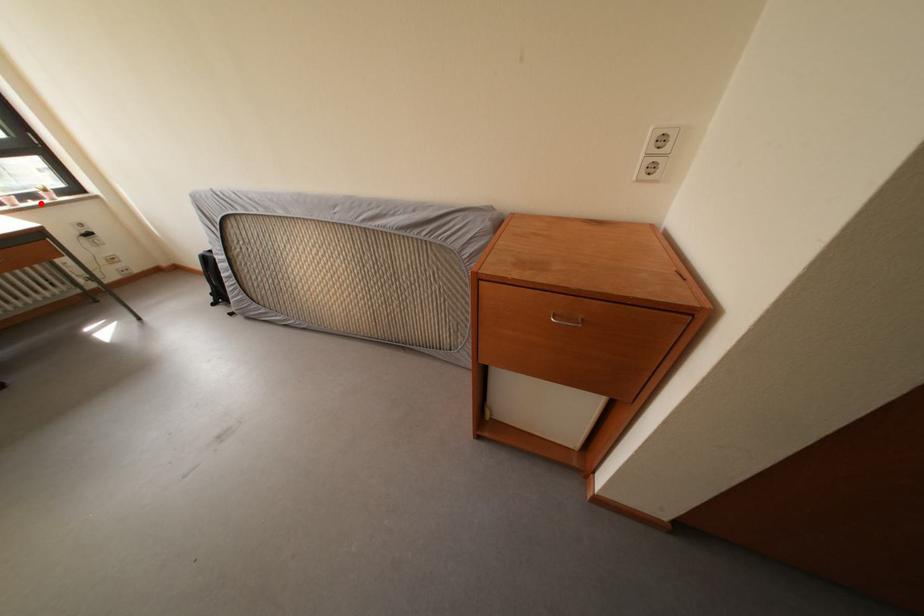
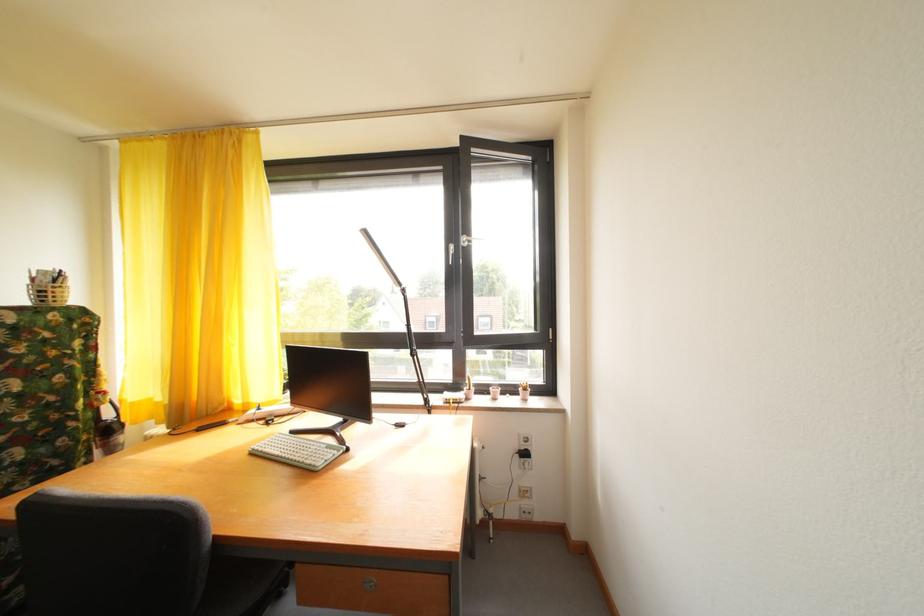
In the second image, find the point that corresponds to the highlighted location in the first image.

(520, 395)